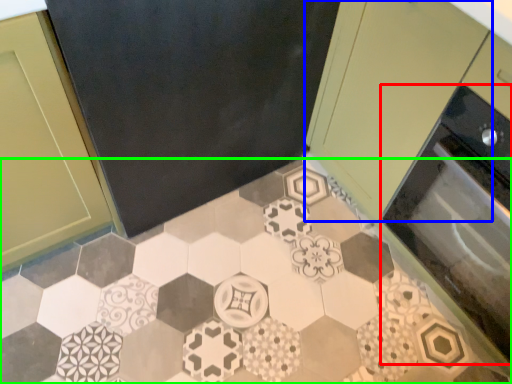
Question: Which object is positioned farthest from oven (highlighted by a red box)? Select from cabinetry (highlighted by a blue box) and ceramic tile (highlighted by a green box).

Choices:
 (A) cabinetry
 (B) ceramic tile

Answer: (B)